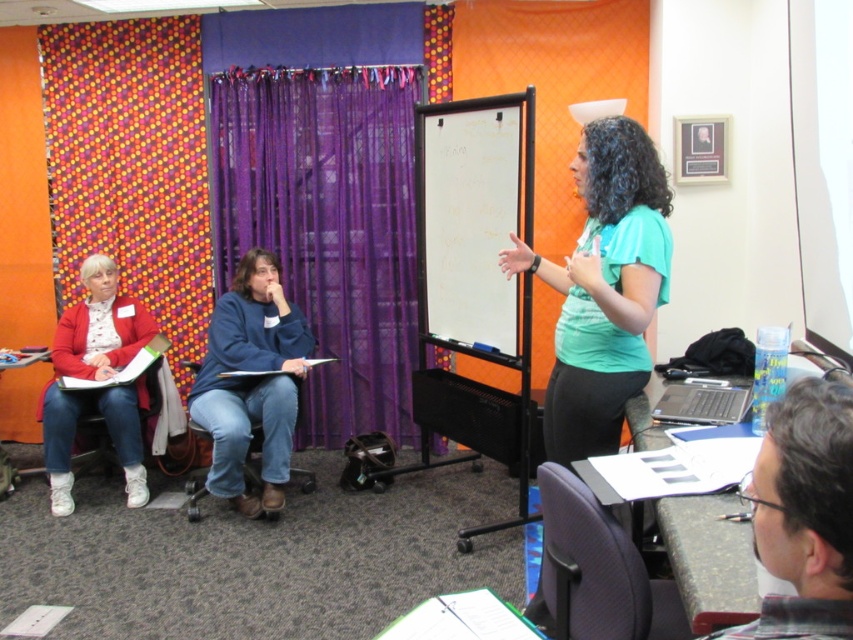
Question: Where is teal matte shirt at center located in relation to plaid fabric shirt at center in the image?

Choices:
 (A) left
 (B) right

Answer: (B)

Question: Based on their relative distances, which object is farther from the brown leather chair at center?

Choices:
 (A) purple sheer curtain at center
 (B) whiteboard at center
 (C) orange dotted fabric at left
 (D) teal matte shirt at center

Answer: (D)

Question: Does purple sheer curtain at center come behind teal matte shirt at center?

Choices:
 (A) yes
 (B) no

Answer: (A)

Question: Which object is farther from the camera taking this photo?

Choices:
 (A) purple sheer curtain at center
 (B) purple fabric chair at lower right

Answer: (A)

Question: Which point appears farthest from the camera in this image?

Choices:
 (A) 569,380
 (B) 799,504

Answer: (A)

Question: Is whiteboard at center bigger than plaid fabric shirt at center?

Choices:
 (A) yes
 (B) no

Answer: (A)